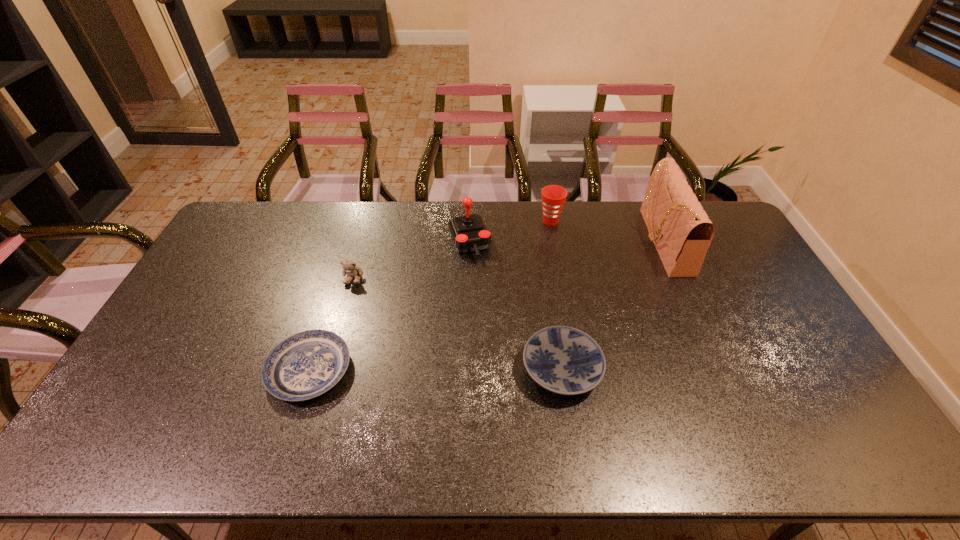
You are a GUI agent. You are given a task and a screenshot of the screen. Output one action in this format:
    pyautogui.click(x=<x>, y=<y>)
    Task: Click on the handbag
    The image size is (960, 540).
    Given the screenshot: What is the action you would take?
    pyautogui.click(x=682, y=232)

Where is `the tallest object`? the tallest object is located at coordinates (682, 232).

Identify the location of the third object from left to right. (469, 233).

This screenshot has width=960, height=540. I want to click on joystick, so click(x=469, y=233).

Identify the location of cup. (553, 197).

This screenshot has height=540, width=960. Identify the location of the third shortest object. (349, 267).

Locate an element on the screen. the taller plate is located at coordinates (564, 360).

Locate an element on the screen. The width and height of the screenshot is (960, 540). the right plate is located at coordinates pos(564,360).

Where is `the shortest object`? The height and width of the screenshot is (540, 960). the shortest object is located at coordinates 305,365.

You are a GUI agent. You are given a task and a screenshot of the screen. Output one action in this format:
    pyautogui.click(x=<x>, y=<y>)
    Task: Click on the shorter plate
    Image resolution: width=960 pixels, height=540 pixels.
    Given the screenshot: What is the action you would take?
    pyautogui.click(x=305, y=365)